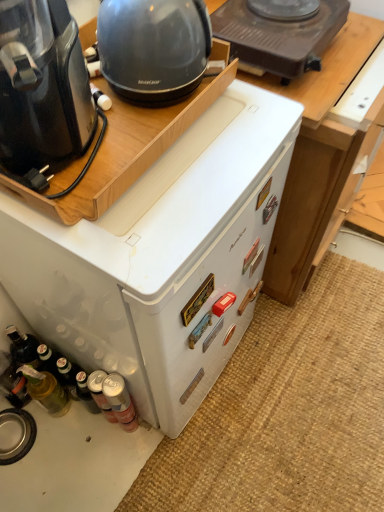
This screenshot has width=384, height=512. Find the location of `free location to the left of metallic silver can at lower left, which is the second bottle from right to left`. free location to the left of metallic silver can at lower left, which is the second bottle from right to left is located at coordinates (63, 435).